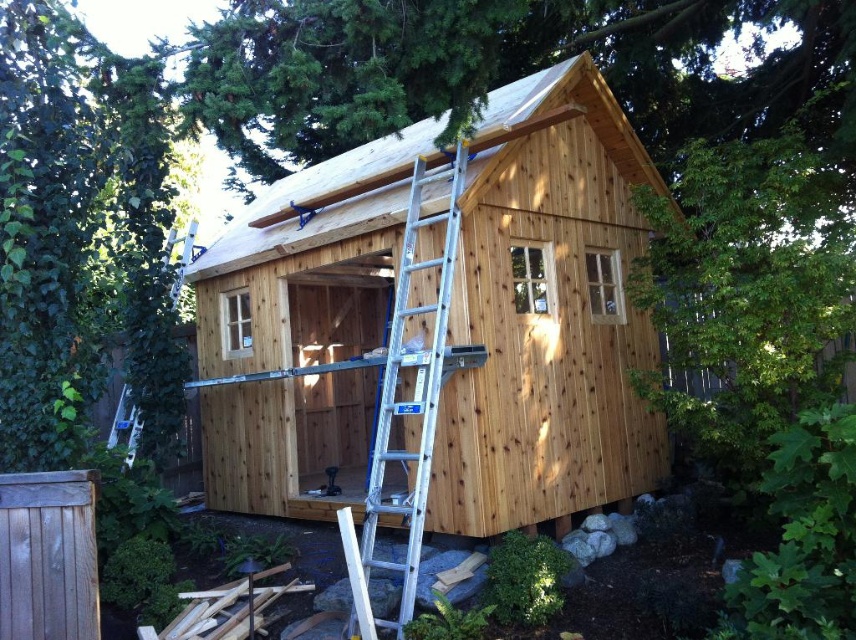
Question: Which object is positioned farthest from the natural wood cabin at center?

Choices:
 (A) silver aluminum ladder at center
 (B) natural wood roof at upper center

Answer: (B)

Question: Which of the following is the farthest from the observer?

Choices:
 (A) (289, 280)
 (B) (417, 353)

Answer: (A)

Question: Which is farther from the natural wood cabin at center?

Choices:
 (A) silver aluminum ladder at center
 (B) natural wood roof at upper center

Answer: (B)

Question: Does natural wood cabin at center have a lesser width compared to silver aluminum ladder at center?

Choices:
 (A) yes
 (B) no

Answer: (B)

Question: Is natural wood cabin at center bigger than silver aluminum ladder at center?

Choices:
 (A) yes
 (B) no

Answer: (A)

Question: In this image, where is natural wood roof at upper center located relative to silver aluminum ladder at center?

Choices:
 (A) left
 (B) right

Answer: (A)